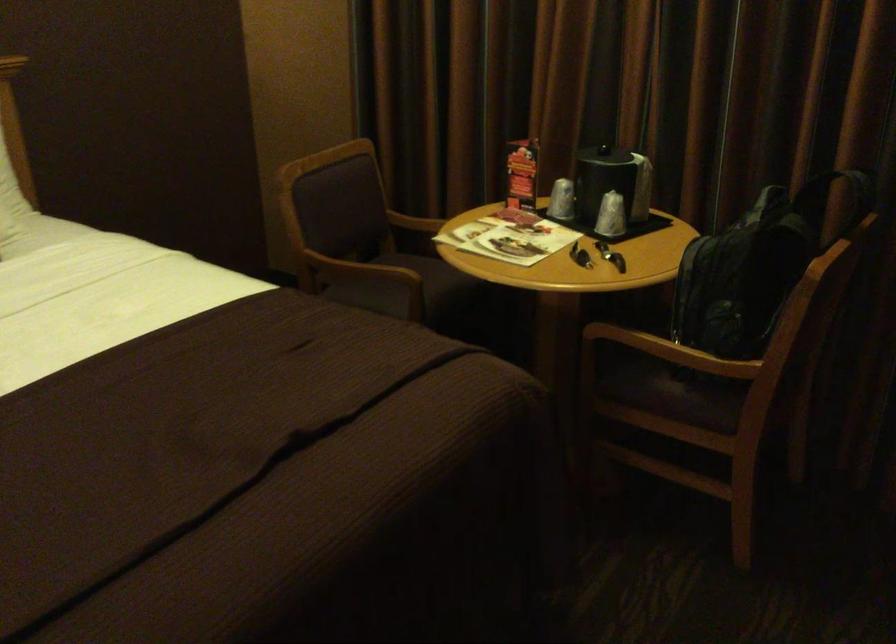
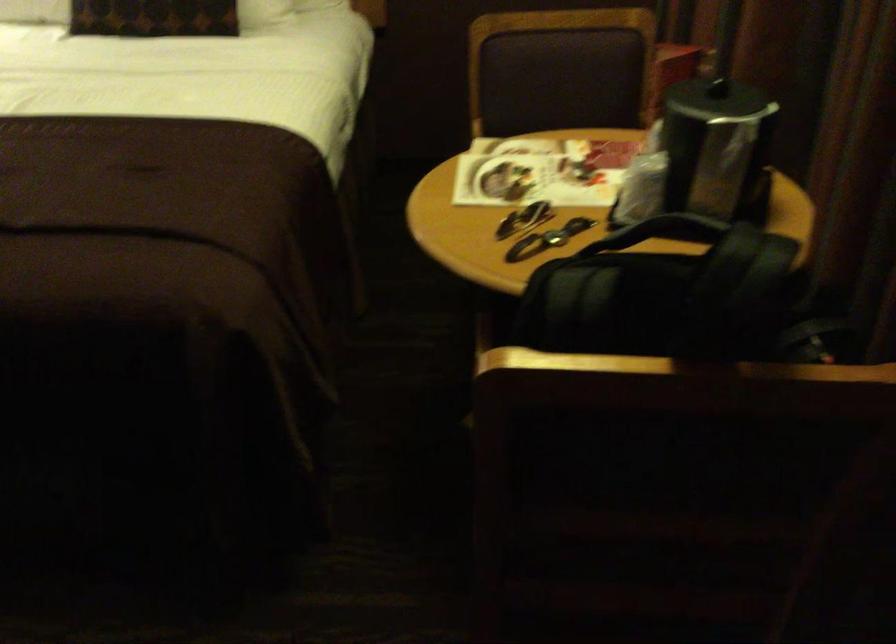
Question: I am providing you with two images of the same scene from different viewpoints. Which of the following objects are not visible in image2?

Choices:
 (A) light-colored trash can
 (B) chair sitting surface
 (C) chair armrest
 (D) steel coffee pot

Answer: (C)